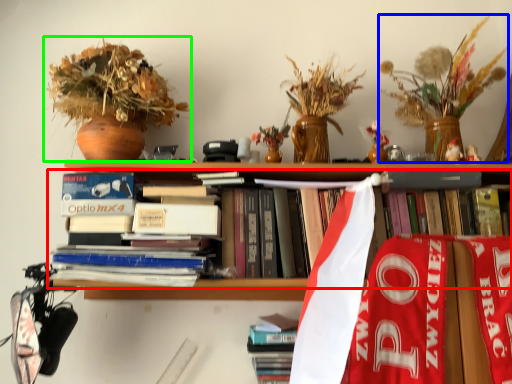
Question: Which object is positioned farthest from book (highlighted by a red box)? Select from floral arrangement (highlighted by a blue box) and houseplant (highlighted by a green box).

Choices:
 (A) floral arrangement
 (B) houseplant

Answer: (A)